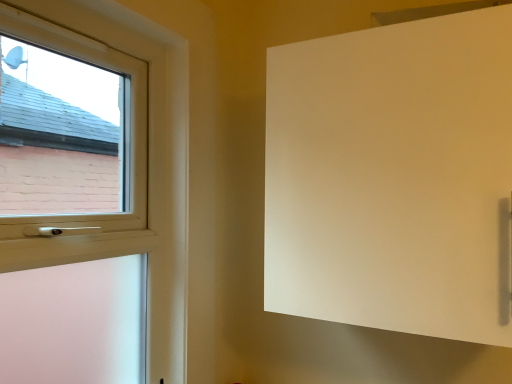
Question: From the image's perspective, is white matte screen door at upper right located above or below white plastic window at left?

Choices:
 (A) above
 (B) below

Answer: (A)

Question: Based on their sizes in the image, would you say white matte screen door at upper right is bigger or smaller than white plastic window at left?

Choices:
 (A) small
 (B) big

Answer: (B)

Question: From a real-world perspective, is white matte screen door at upper right above or below white plastic window at left?

Choices:
 (A) below
 (B) above

Answer: (B)

Question: In terms of width, does white plastic window at left look wider or thinner when compared to white matte screen door at upper right?

Choices:
 (A) thin
 (B) wide

Answer: (A)

Question: From the image's perspective, is white plastic window at left positioned above or below white matte screen door at upper right?

Choices:
 (A) above
 (B) below

Answer: (B)

Question: Looking at the image, does white plastic window at left seem bigger or smaller compared to white matte screen door at upper right?

Choices:
 (A) small
 (B) big

Answer: (A)

Question: From their relative heights in the image, would you say white plastic window at left is taller or shorter than white matte screen door at upper right?

Choices:
 (A) tall
 (B) short

Answer: (A)